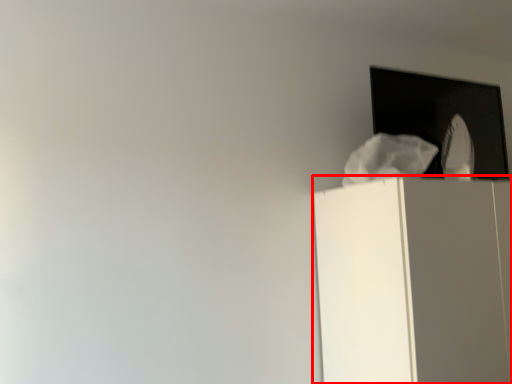
Question: Where is furniture (annotated by the red box) located in relation to window in the image?

Choices:
 (A) left
 (B) right

Answer: (B)